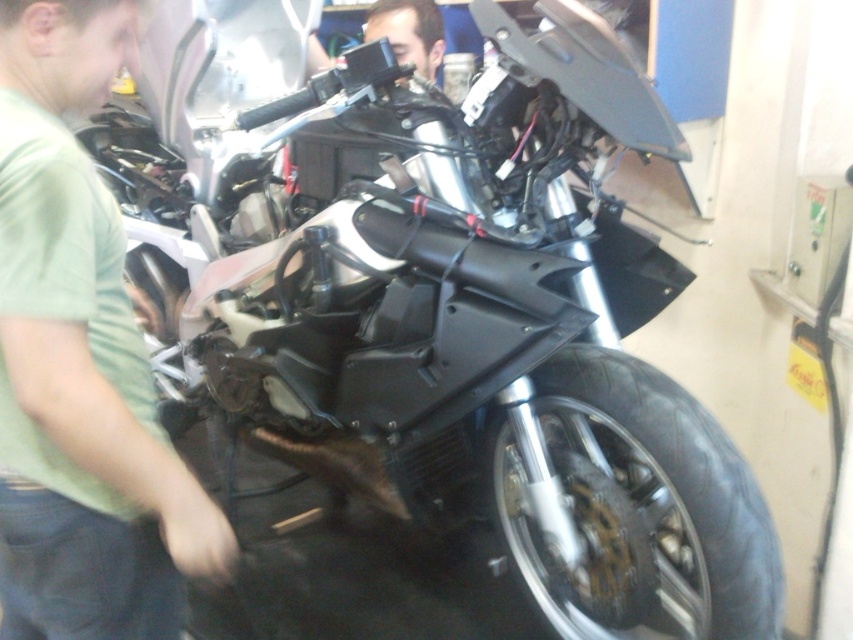
You are a mechanic working in the garage. You need to install a new part that requires accessing both the black rubber tire at lower right and the matte black camera at upper center. Since you have a ladder that can reach up to 1.5 meters, will you need it for either of these objects?

The black rubber tire at lower right has a greater height compared to matte black camera at upper center. Since the tire is taller than the camera, and the ladder can reach up to 1.5 meters, you would need to assess the exact heights. However, without specific measurements, it is safer to assume the ladder might be necessary if the tire exceeds 1.5 meters. But according to the description, the tire is only taller than the camera, not necessarily taller than 1.5 meters. Therefore, the ladder may not beneeded

You are standing in the workshop and need to locate the green matte shirt at left. According to the spatial coordinates provided, where exactly should you look to find it?

The green matte shirt at left is located at point 0.567 on the x axis and 0.095 on the y axis.

You are a mechanic in a garage. You need to access a part located at point (640, 568) and another part at point (440, 20). Which part is closer to the front of the motorcycle?

Point (640, 568) is in front of point (440, 20), so the part at point (640, 568) is closer to the front of the motorcycle.